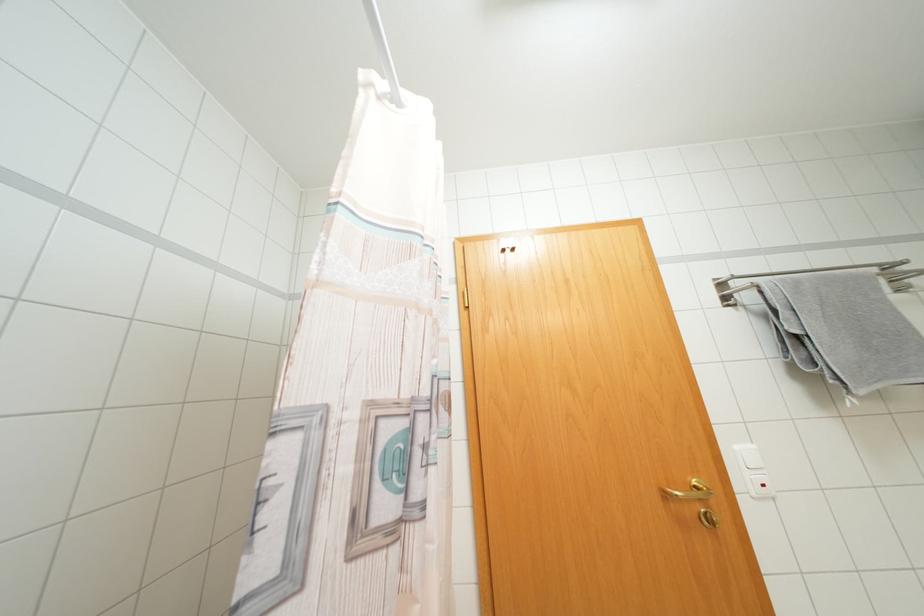
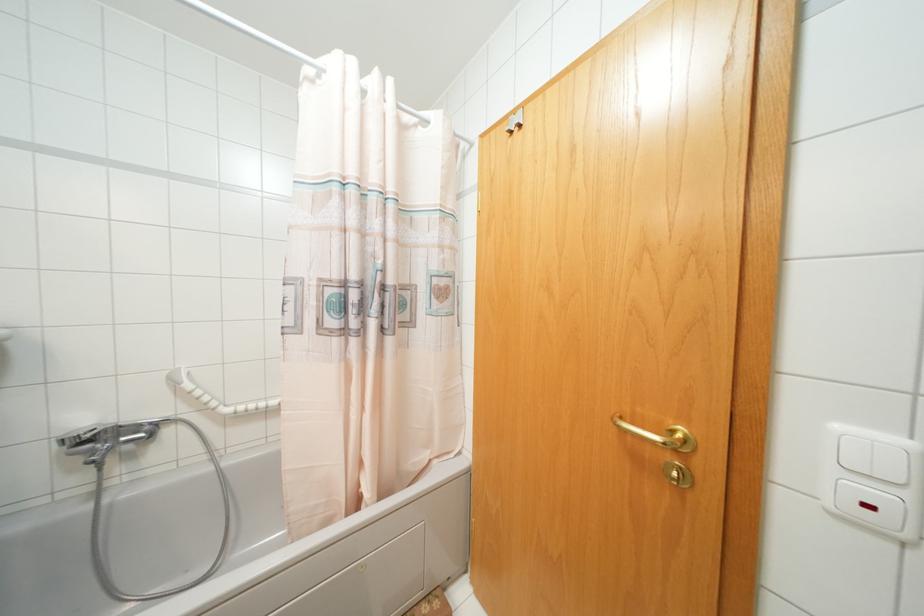
The point at (754, 446) is marked in the first image. Where is the corresponding point in the second image?

(906, 442)